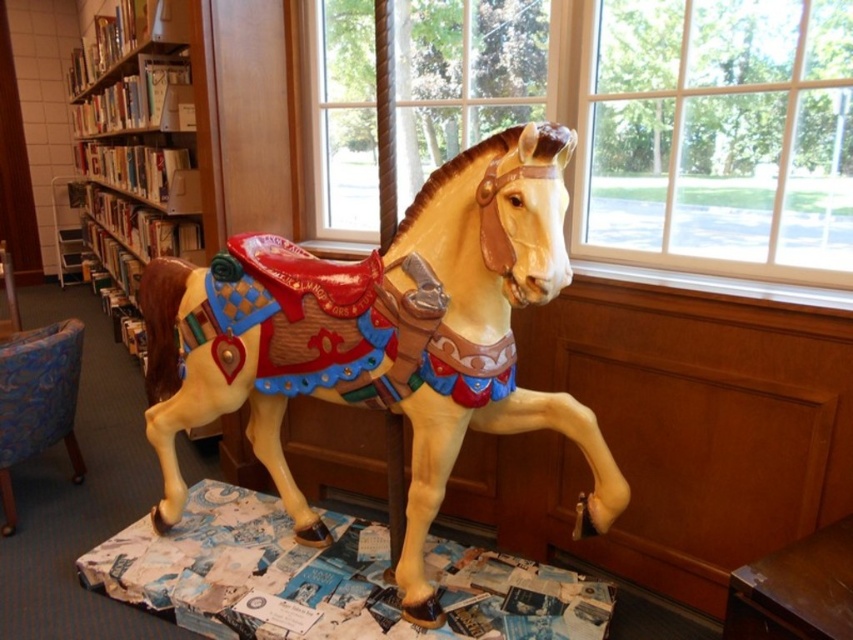
Question: Which point is farther to the camera?

Choices:
 (A) (12, 372)
 (B) (184, 394)

Answer: (A)

Question: Which point is closer to the camera taking this photo?

Choices:
 (A) (167, 156)
 (B) (556, 401)
 (C) (9, 481)

Answer: (B)

Question: Which point is closer to the camera?

Choices:
 (A) click(x=370, y=396)
 (B) click(x=567, y=228)

Answer: (A)

Question: Is wooden bookcase at left below blue fabric chair at lower left?

Choices:
 (A) yes
 (B) no

Answer: (B)

Question: Can you confirm if wooden bookcase at left is positioned to the right of blue fabric chair at lower left?

Choices:
 (A) no
 (B) yes

Answer: (A)

Question: Can you confirm if painted wood horse at center is smaller than wooden bookcase at left?

Choices:
 (A) no
 (B) yes

Answer: (B)